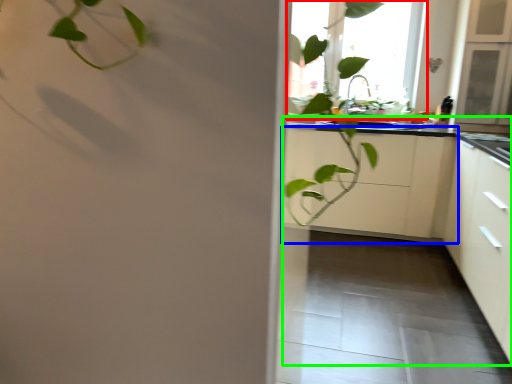
Question: Based on their relative distances, which object is nearer to window (highlighted by a red box)? Choose from cabinetry (highlighted by a blue box) and counter top (highlighted by a green box).

Choices:
 (A) cabinetry
 (B) counter top

Answer: (A)